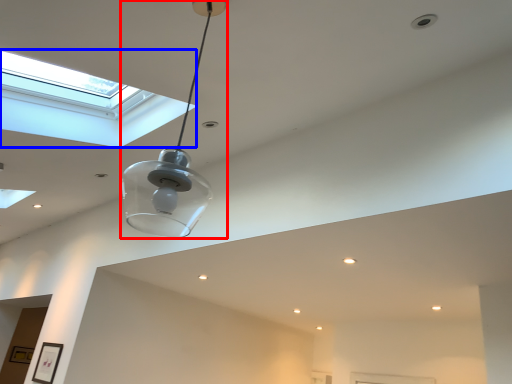
Question: Among these objects, which one is nearest to the camera, lamp (highlighted by a red box) or window (highlighted by a blue box)?

Choices:
 (A) lamp
 (B) window

Answer: (A)